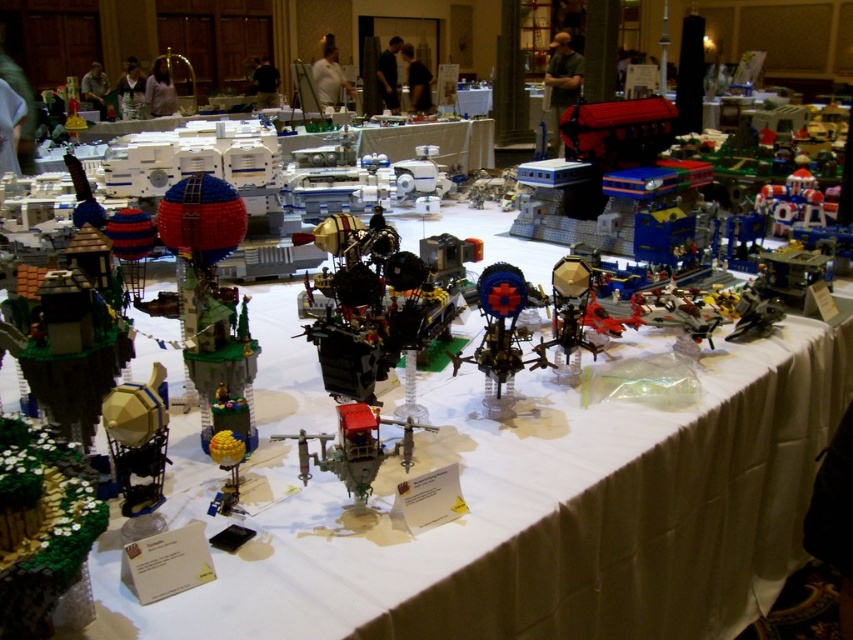
Is brick-like hot air balloon at center-left further to camera compared to metallic blue sphere at center?

→ Yes, it is.

Between point (209, 188) and point (115, 408), which one is positioned behind?

Point (209, 188)

Is point (195, 182) positioned after point (148, 440)?

Yes.

I want to click on brick-like hot air balloon at center-left, so pyautogui.click(x=207, y=284).

Which is above, brick-like hot air balloon at center-left or metallic gold sphere at center?

brick-like hot air balloon at center-left

Does brick-like hot air balloon at center-left appear over metallic gold sphere at center?

Yes.

At what (x,y) coordinates should I click in order to perform the action: click on brick-like hot air balloon at center-left. Please return your answer as a coordinate pair (x, y). Image resolution: width=853 pixels, height=640 pixels. Looking at the image, I should click on (207, 284).

Who is positioned more to the left, brick-like hot air balloon at center-left or matte red helicopter at center?

Positioned to the left is brick-like hot air balloon at center-left.

Does point (175, 208) come closer to viewer compared to point (287, 436)?

No, it is behind (287, 436).

Identify the location of brick-like hot air balloon at center-left. [207, 284].